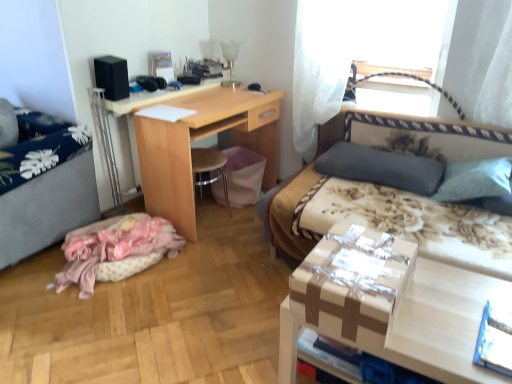
Question: Is dark gray fabric pillow at upper right in front of or behind pink fabric at lower left in the image?

Choices:
 (A) front
 (B) behind

Answer: (B)

Question: From a real-world perspective, is dark gray fabric pillow at upper right above or below pink fabric at lower left?

Choices:
 (A) above
 (B) below

Answer: (A)

Question: Estimate the real-world distances between objects in this image. Which object is farther from the wooden desk at center?

Choices:
 (A) floral fabric bed at right
 (B) matte cardboard box at lower right
 (C) black matte speaker at upper left
 (D) dark gray fabric pillow at upper right
 (E) gray fabric hospital bed at left

Answer: (B)

Question: Which of these objects is positioned farthest from the floral fabric bed at right?

Choices:
 (A) matte brown cardboard box at center
 (B) wooden desk at center
 (C) black matte speaker at upper left
 (D) pink fabric at lower left
 (E) dark gray fabric pillow at upper right

Answer: (C)